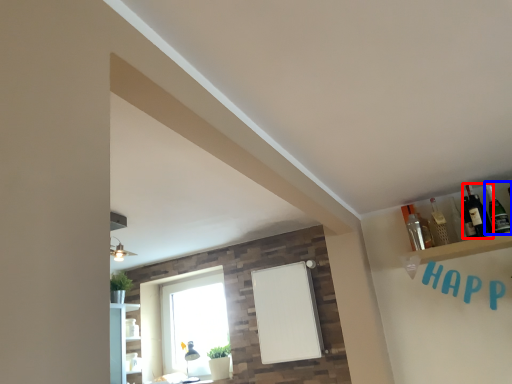
Question: Which point is closer to the camera, bottle (highlighted by a red box) or bottle (highlighted by a blue box)?

Choices:
 (A) bottle
 (B) bottle

Answer: (B)